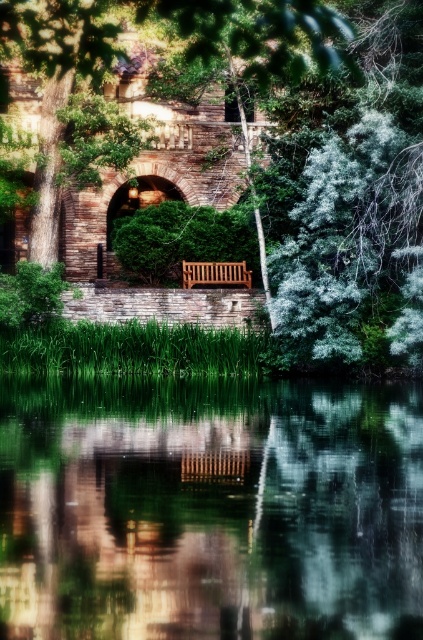
Which is behind, point (274, 276) or point (231, 273)?

The point (231, 273) is behind.

Between green leafy tree at center and teak wood bench at center, which one has more height?

Standing taller between the two is green leafy tree at center.

Identify the location of green leafy tree at center. The image size is (423, 640). (291, 134).

Measure the distance between green reflective water at center and green leafy tree at center.

9.61 meters

Identify the location of green reflective water at center. (209, 509).

Is point (231, 420) in front of point (384, 84)?

Yes, point (231, 420) is closer to viewer.

The image size is (423, 640). In order to click on green reflective water at center in this screenshot , I will do `click(209, 509)`.

You are a GUI agent. You are given a task and a screenshot of the screen. Output one action in this format:
    pyautogui.click(x=<x>, y=<y>)
    Task: Click on the green reflective water at center
    
    Given the screenshot: What is the action you would take?
    pyautogui.click(x=209, y=509)

Who is more forward, [82,436] or [187,272]?

Positioned in front is point [82,436].

The width and height of the screenshot is (423, 640). Identify the location of green reflective water at center. (209, 509).